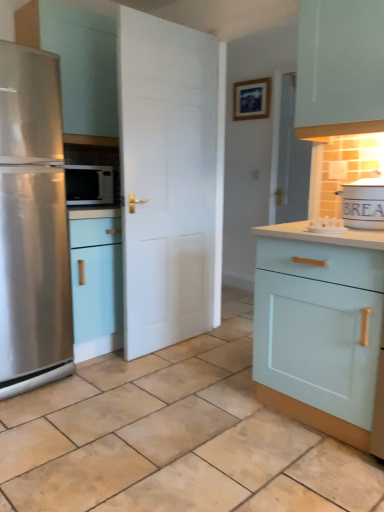
Where is `free space between stainless steel refrigerator at left and light blue wood cabinet at right`? The image size is (384, 512). free space between stainless steel refrigerator at left and light blue wood cabinet at right is located at coordinates (172, 396).